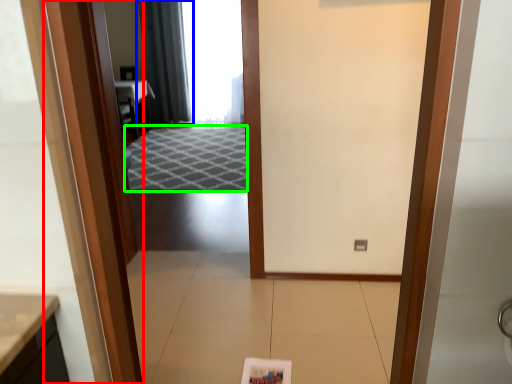
Question: Which object is the farthest from door (highlighted by a red box)? Choose among these: curtain (highlighted by a blue box) or doormat (highlighted by a green box).

Choices:
 (A) curtain
 (B) doormat

Answer: (A)